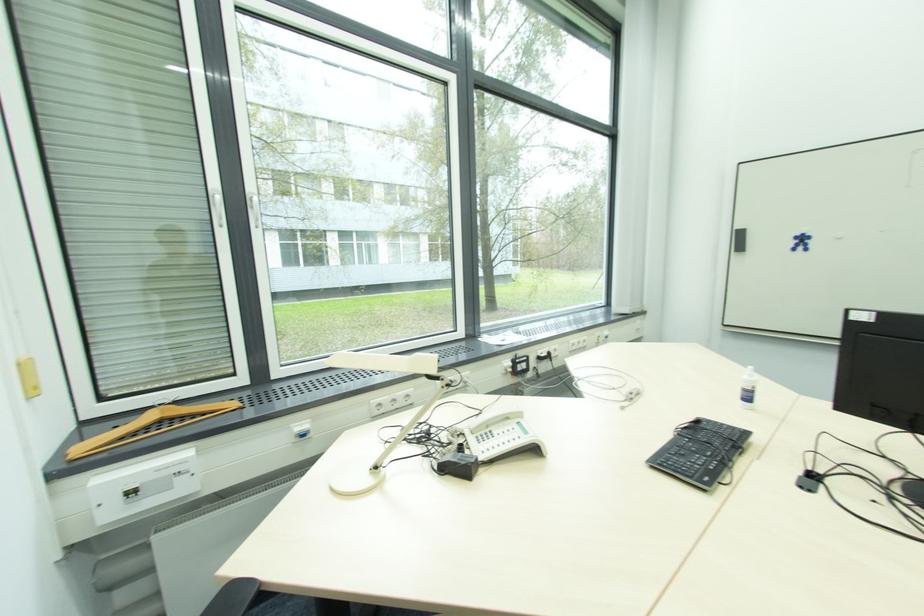
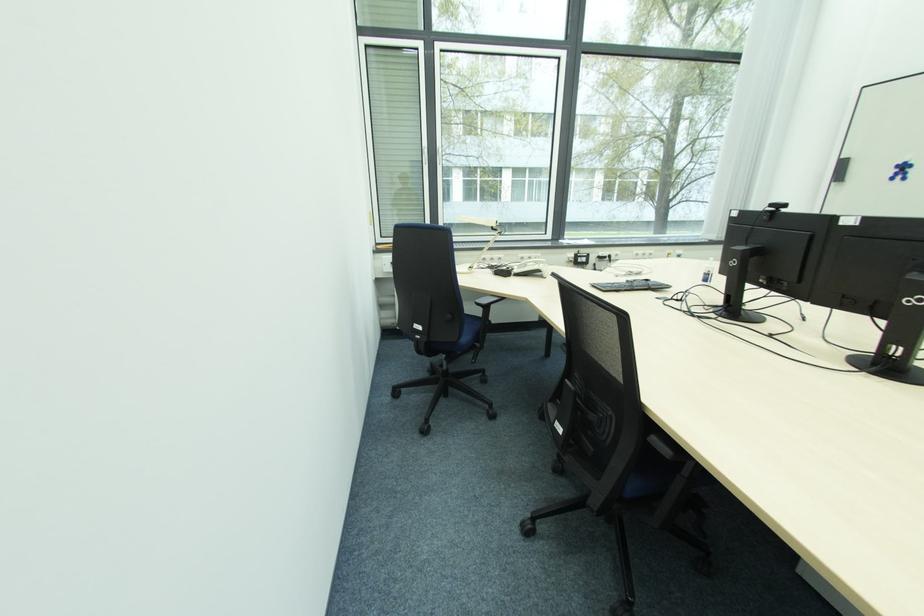
Locate, in the second image, the point that corresponds to (x=700, y=424) in the first image.

(650, 283)